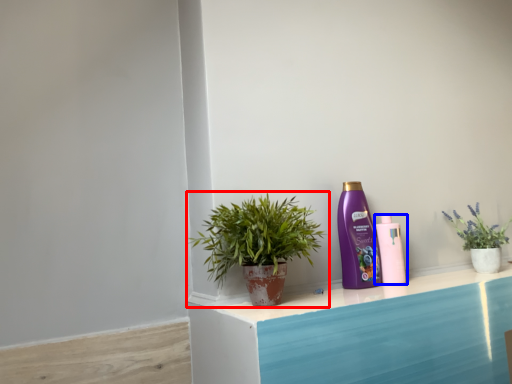
Question: Which point is closer to the camera, houseplant (highlighted by a red box) or bottle (highlighted by a blue box)?

Choices:
 (A) houseplant
 (B) bottle

Answer: (A)